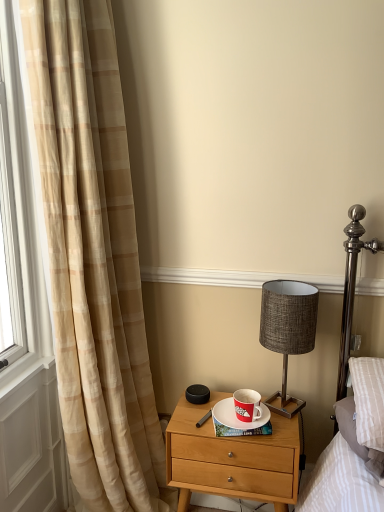
Question: From the image's perspective, relative to white ceramic saucer at center, is red matte coffee cup at center above or below?

Choices:
 (A) below
 (B) above

Answer: (B)

Question: Is red matte coffee cup at center in front of or behind white ceramic saucer at center in the image?

Choices:
 (A) front
 (B) behind

Answer: (A)

Question: Which is farther from the red matte coffee cup at center?

Choices:
 (A) white ceramic saucer at center
 (B) wooden nightstand at center
 (C) metallic gray lampshade at center-right
 (D) beige plaid curtain at left

Answer: (D)

Question: Which is farther from the wooden nightstand at center?

Choices:
 (A) red matte coffee cup at center
 (B) beige plaid curtain at left
 (C) metallic gray lampshade at center-right
 (D) white ceramic saucer at center

Answer: (B)